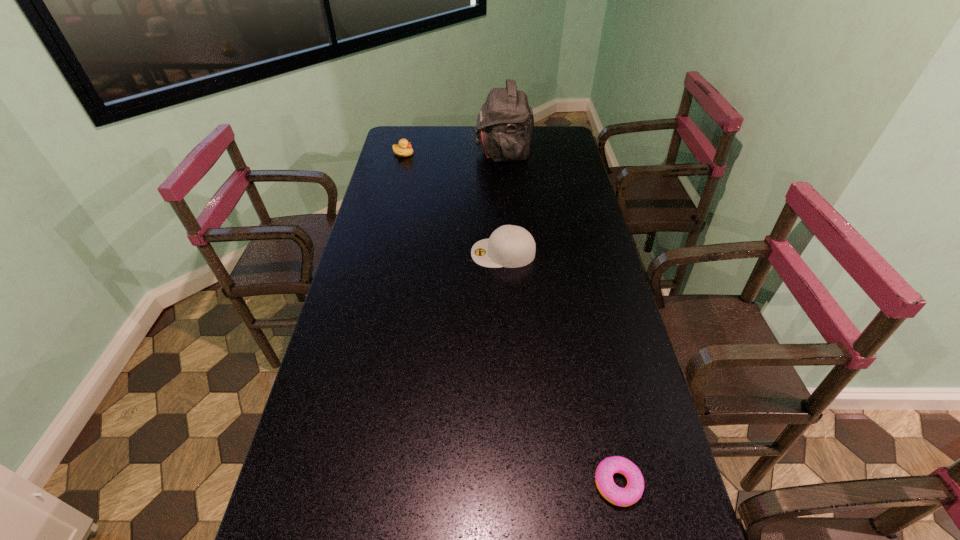
Identify the location of vacant area that satisfies the following two spatial constraints: 1. on the open flap of the shoulder bag; 2. on the right side of the rightmost object. (528, 483).

Where is `free location that satisfies the following two spatial constraints: 1. on the open flap of the tallest object; 2. on the left side of the doughnut`? This screenshot has height=540, width=960. free location that satisfies the following two spatial constraints: 1. on the open flap of the tallest object; 2. on the left side of the doughnut is located at coordinates (528, 483).

At what (x,y) coordinates should I click in order to perform the action: click on blank area in the image that satisfies the following two spatial constraints: 1. at the face of the rightmost object; 2. on the right side of the third tallest object. Please return your answer as a coordinate pair (x, y). The image size is (960, 540). Looking at the image, I should click on (324, 483).

The width and height of the screenshot is (960, 540). I want to click on vacant space that satisfies the following two spatial constraints: 1. on the open flap of the shortest object; 2. on the right side of the shoulder bag, so click(x=528, y=483).